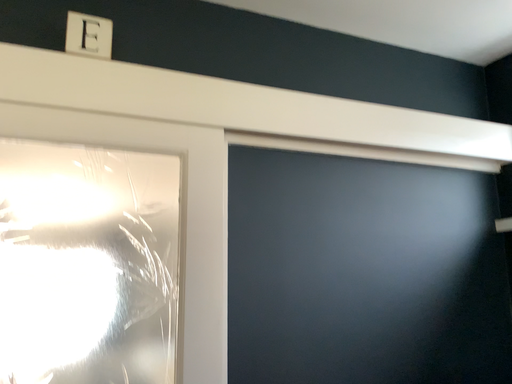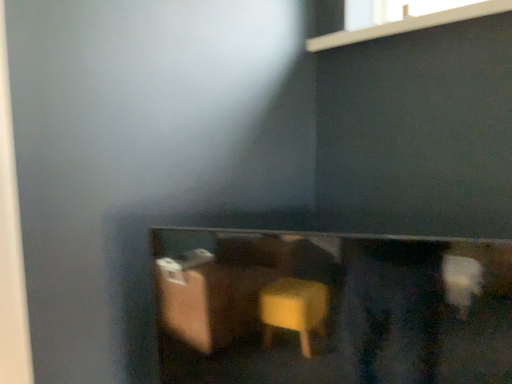
Question: Which way did the camera rotate in the video?

Choices:
 (A) rotated right
 (B) rotated left

Answer: (A)